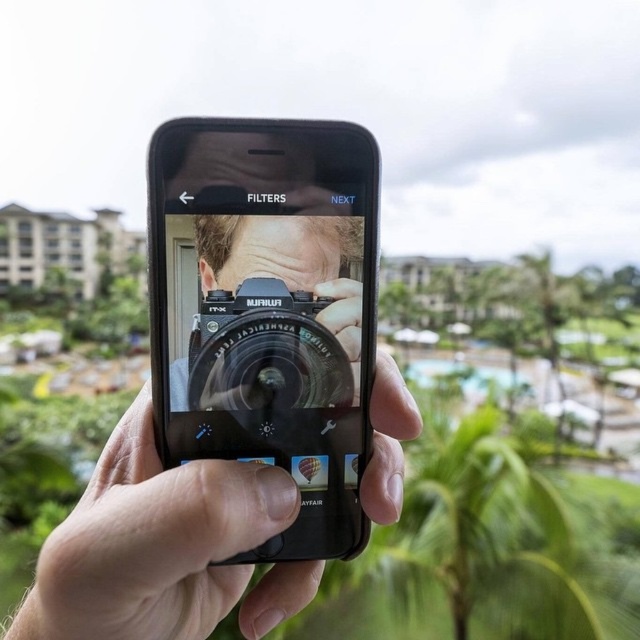
Question: In this image, where is black matte smartphone at center located relative to matte black phone at center?

Choices:
 (A) above
 (B) below

Answer: (A)

Question: Among these objects, which one is nearest to the camera?

Choices:
 (A) black matte smartphone at center
 (B) matte black phone at center

Answer: (B)

Question: Among these points, which one is farthest from the camera?

Choices:
 (A) coord(262,248)
 (B) coord(106,577)

Answer: (A)

Question: Observing the image, what is the correct spatial positioning of black matte smartphone at center in reference to matte black phone at center?

Choices:
 (A) below
 (B) above

Answer: (B)

Question: Does black matte smartphone at center have a larger size compared to matte black phone at center?

Choices:
 (A) no
 (B) yes

Answer: (A)